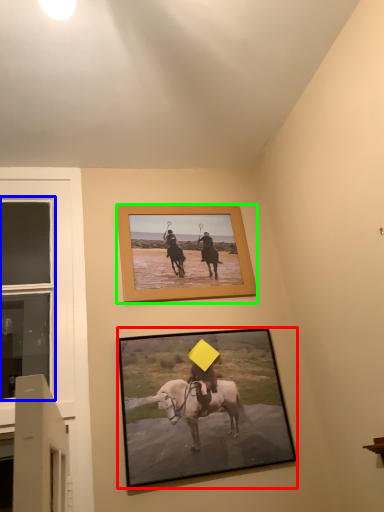
Question: Which object is the farthest from picture frame (highlighted by a red box)? Choose among these: window (highlighted by a blue box) or picture frame (highlighted by a green box).

Choices:
 (A) window
 (B) picture frame

Answer: (A)